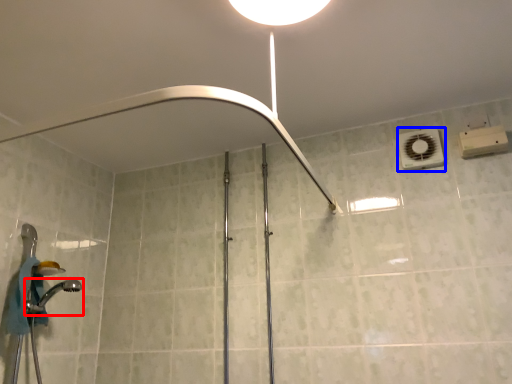
Question: Which of the following is the farthest to the observer, shower (highlighted by a red box) or air conditioner (highlighted by a blue box)?

Choices:
 (A) shower
 (B) air conditioner

Answer: (B)